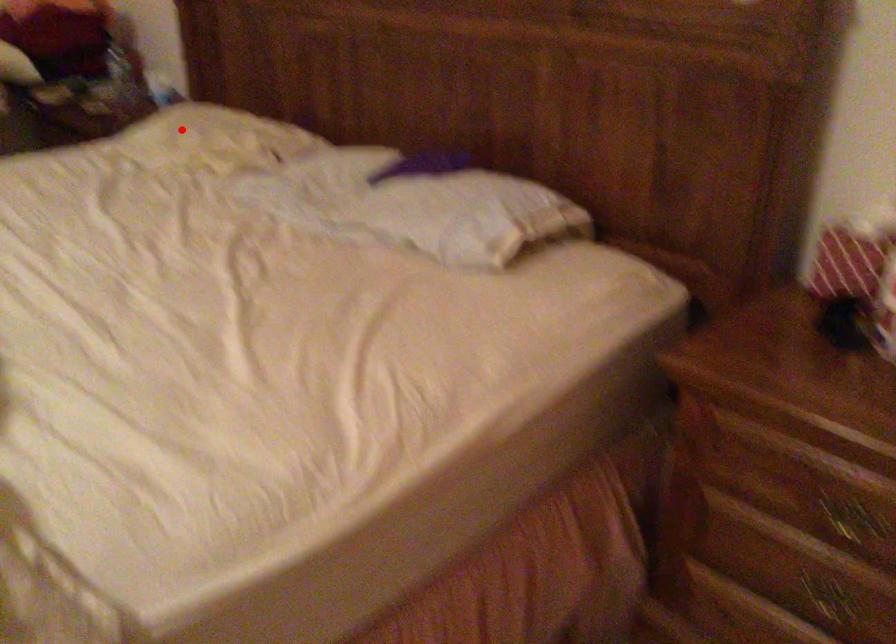
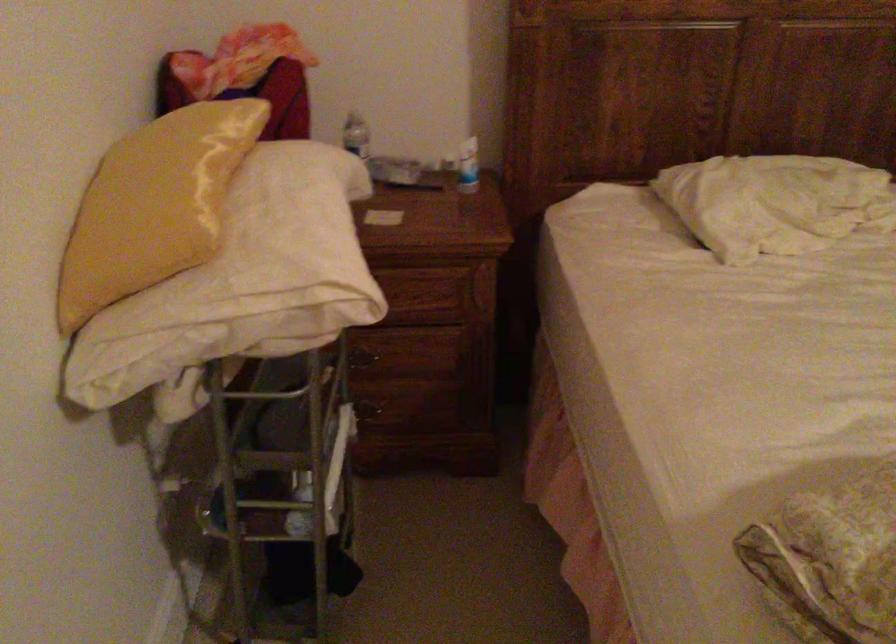
Find the pixel in the second image that matches the highlighted location in the first image.

(774, 202)